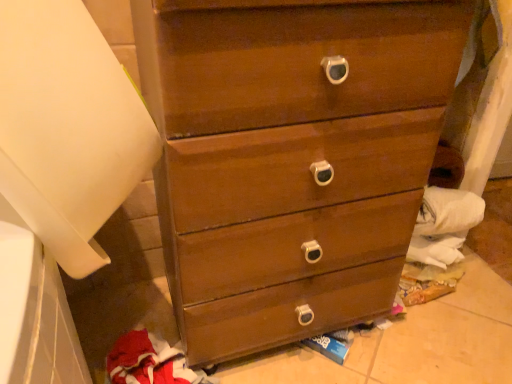
Question: Should I look upward or downward to see red fleece sweatshirt at lower left?

Choices:
 (A) down
 (B) up

Answer: (A)

Question: Is red fleece sweatshirt at lower left facing away from matte wood chest of drawers at center?

Choices:
 (A) yes
 (B) no

Answer: (B)

Question: Is red fleece sweatshirt at lower left positioned behind matte wood chest of drawers at center?

Choices:
 (A) no
 (B) yes

Answer: (B)

Question: Is red fleece sweatshirt at lower left positioned beyond the bounds of matte wood chest of drawers at center?

Choices:
 (A) no
 (B) yes

Answer: (B)

Question: Is red fleece sweatshirt at lower left aimed at matte wood chest of drawers at center?

Choices:
 (A) yes
 (B) no

Answer: (B)

Question: Can you confirm if red fleece sweatshirt at lower left is taller than matte wood chest of drawers at center?

Choices:
 (A) yes
 (B) no

Answer: (B)

Question: Is red fleece sweatshirt at lower left far away from matte wood chest of drawers at center?

Choices:
 (A) yes
 (B) no

Answer: (B)

Question: From a real-world perspective, is red fleece sweatshirt at lower left physically below white matte paper towel at left?

Choices:
 (A) yes
 (B) no

Answer: (A)

Question: Is red fleece sweatshirt at lower left behind white matte paper towel at left?

Choices:
 (A) yes
 (B) no

Answer: (A)

Question: Is red fleece sweatshirt at lower left looking in the opposite direction of white matte paper towel at left?

Choices:
 (A) yes
 (B) no

Answer: (B)

Question: Does red fleece sweatshirt at lower left have a greater width compared to white matte paper towel at left?

Choices:
 (A) yes
 (B) no

Answer: (B)

Question: Does red fleece sweatshirt at lower left appear on the right side of white matte paper towel at left?

Choices:
 (A) no
 (B) yes

Answer: (B)

Question: Is red fleece sweatshirt at lower left shorter than white matte paper towel at left?

Choices:
 (A) yes
 (B) no

Answer: (A)

Question: Are white matte paper towel at left and matte wood chest of drawers at center far apart?

Choices:
 (A) no
 (B) yes

Answer: (A)